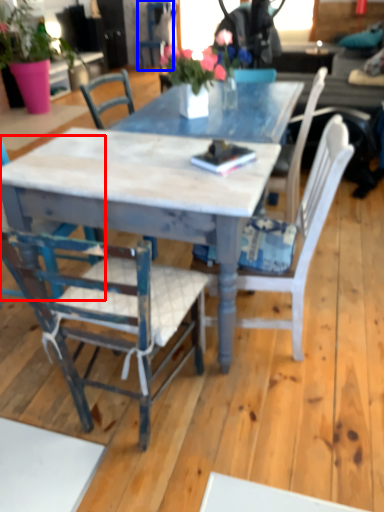
Question: Which point is further to the camera, chair (highlighted by a red box) or chair (highlighted by a blue box)?

Choices:
 (A) chair
 (B) chair

Answer: (B)